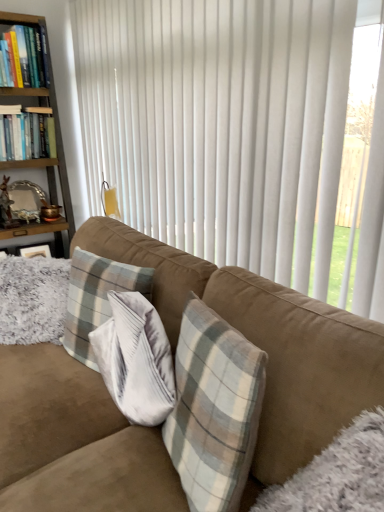
Question: In terms of width, does plaid fabric pillow at center look wider or thinner when compared to hardcover book at upper left, which is the 2th book from bottom to top?

Choices:
 (A) thin
 (B) wide

Answer: (A)

Question: From the image's perspective, relative to hardcover book at upper left, the 1th book when ordered from top to bottom, is plaid fabric pillow at center above or below?

Choices:
 (A) above
 (B) below

Answer: (B)

Question: Which object is the closest to the plaid fabric pillow at center?

Choices:
 (A) wooden bookshelf at left
 (B) suede couch at center
 (C) hardcover books at left, the second book when ordered from top to bottom
 (D) hardcover book at upper left, the 1th book when ordered from top to bottom
 (E) white vertical blinds at center

Answer: (B)

Question: Estimate the real-world distances between objects in this image. Which object is farther from the plaid fabric pillow at center?

Choices:
 (A) suede couch at center
 (B) wooden bookshelf at left
 (C) hardcover books at left, the second book when ordered from top to bottom
 (D) hardcover book at upper left, the 1th book when ordered from top to bottom
 (E) white vertical blinds at center

Answer: (D)